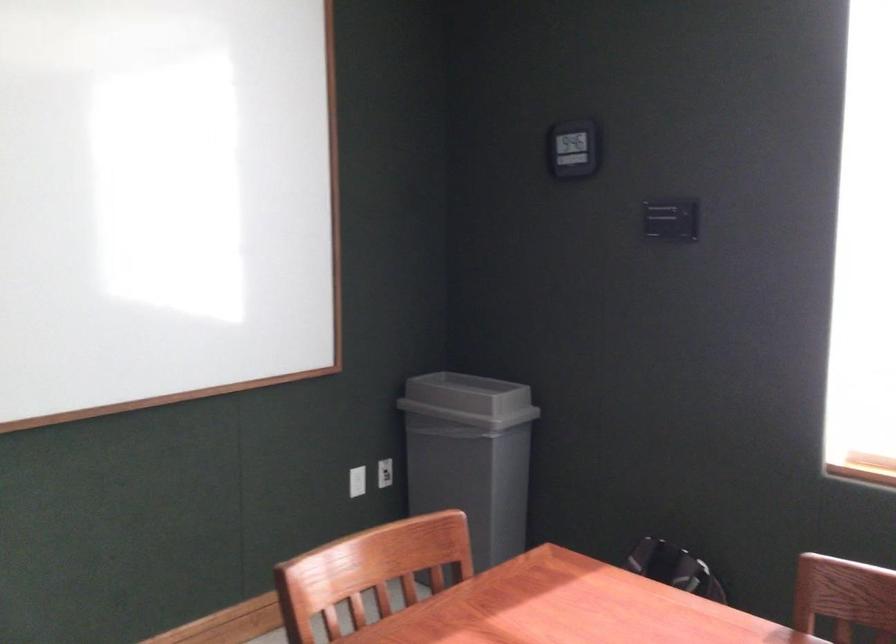
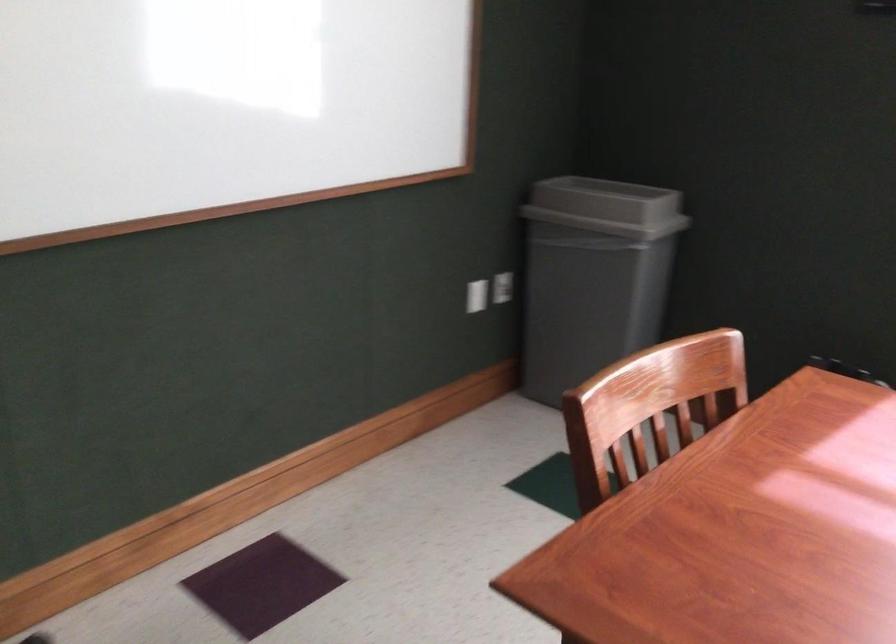
Question: The images are taken continuously from a first-person perspective. In which direction is your viewpoint rotating?

Choices:
 (A) Left
 (B) Right
 (C) Up
 (D) Down

Answer: (D)